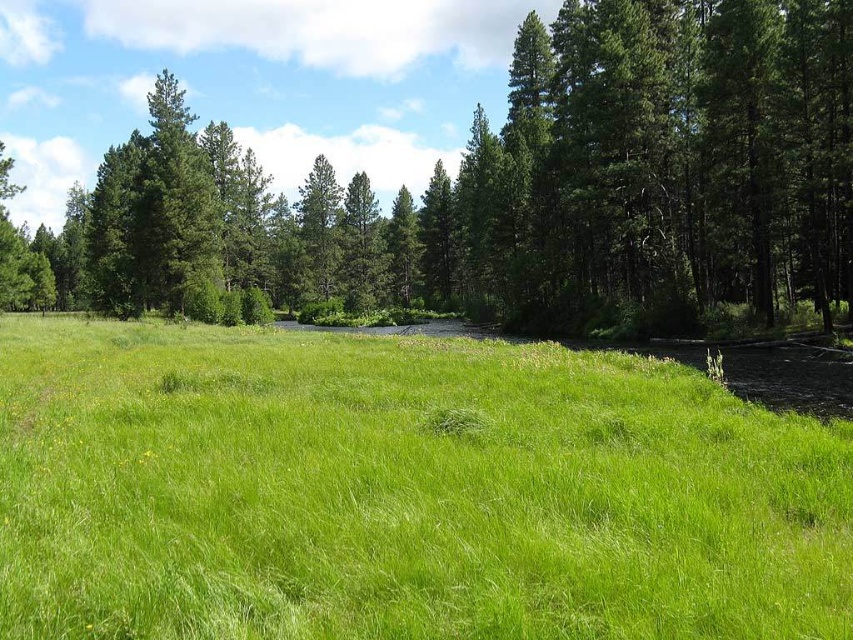
Does green grassy at center have a smaller size compared to green leafy tree at center?

Yes.

Between green grassy at center and green leafy tree at center, which one appears on the left side from the viewer's perspective?

Positioned to the left is green leafy tree at center.

Does point (607, 384) lie in front of point (567, 288)?

Yes, point (607, 384) is in front of point (567, 288).

You are a GUI agent. You are given a task and a screenshot of the screen. Output one action in this format:
    pyautogui.click(x=<x>, y=<y>)
    Task: Click on the green grassy at center
    
    Given the screenshot: What is the action you would take?
    pyautogui.click(x=402, y=492)